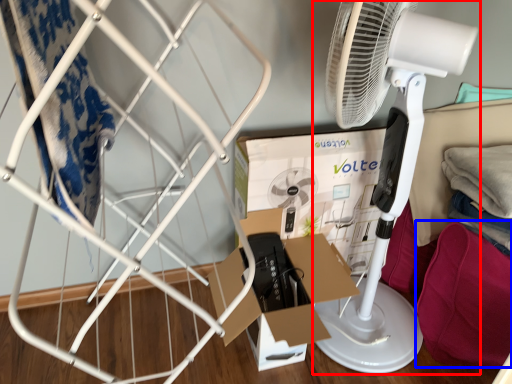
Question: Which point is closer to the camera, mechanical fan (highlighted by a red box) or clothing (highlighted by a blue box)?

Choices:
 (A) mechanical fan
 (B) clothing

Answer: (A)